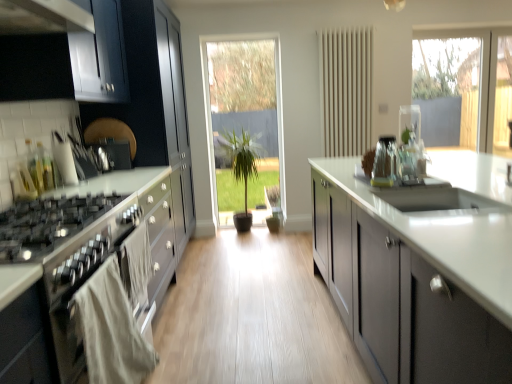
Question: Is matte gray cabinets at center, the 1th cabinetry in the front-to-back sequence, facing away from transparent glass door at center?

Choices:
 (A) no
 (B) yes

Answer: (A)

Question: Does matte gray cabinets at center, which appears as the first cabinetry when viewed from the right, have a lesser width compared to transparent glass door at center?

Choices:
 (A) yes
 (B) no

Answer: (B)

Question: Is matte gray cabinets at center, the 2th cabinetry when ordered from back to front, completely or partially outside of transparent glass door at center?

Choices:
 (A) yes
 (B) no

Answer: (A)

Question: Does matte gray cabinets at center, acting as the second cabinetry starting from the left, have a larger size compared to transparent glass door at center?

Choices:
 (A) no
 (B) yes

Answer: (B)

Question: Could you tell me if matte gray cabinets at center, the 2th cabinetry when ordered from back to front, is facing transparent glass door at center?

Choices:
 (A) no
 (B) yes

Answer: (A)

Question: From a real-world perspective, is matte gray cabinets at center, acting as the second cabinetry starting from the left, over transparent glass door at center?

Choices:
 (A) no
 (B) yes

Answer: (A)

Question: Considering the relative sizes of matte black cabinets at left, positioned as the 2th cabinetry in front-to-back order, and clear glass vase at center, positioned as the third appliance in back-to-front order, in the image provided, is matte black cabinets at left, positioned as the 2th cabinetry in front-to-back order, taller than clear glass vase at center, positioned as the third appliance in back-to-front order,?

Choices:
 (A) no
 (B) yes

Answer: (B)

Question: Can you confirm if matte black cabinets at left, which ranks as the 2th cabinetry in right-to-left order, is positioned to the left of clear glass vase at center, positioned as the third appliance in back-to-front order?

Choices:
 (A) no
 (B) yes

Answer: (B)

Question: Is matte black cabinets at left, which is counted as the 1th cabinetry, starting from the back, smaller than clear glass vase at center, the second appliance when ordered from right to left?

Choices:
 (A) no
 (B) yes

Answer: (A)

Question: Is the surface of matte black cabinets at left, the first cabinetry in the left-to-right sequence, in direct contact with clear glass vase at center, positioned as the third appliance in back-to-front order?

Choices:
 (A) no
 (B) yes

Answer: (A)

Question: Would you say matte black cabinets at left, which is counted as the 1th cabinetry, starting from the back, contains clear glass vase at center, positioned as the second appliance in left-to-right order?

Choices:
 (A) yes
 (B) no

Answer: (B)

Question: Is matte black cabinets at left, which is counted as the 1th cabinetry, starting from the back, turned away from clear glass vase at center, the second appliance when ordered from right to left?

Choices:
 (A) yes
 (B) no

Answer: (B)

Question: Does clear glass vase at upper center, the 1th appliance from the right, have a greater height compared to matte gray cabinets at center, the 2th cabinetry when ordered from back to front?

Choices:
 (A) no
 (B) yes

Answer: (A)